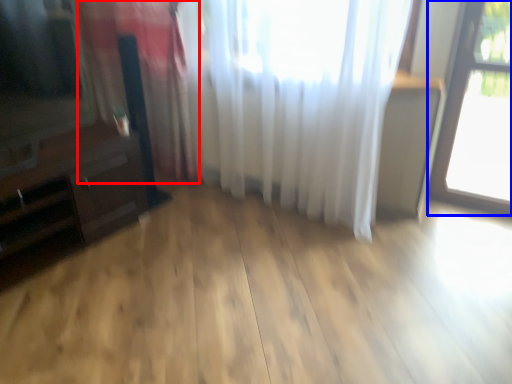
Question: Which object is further to the camera taking this photo, curtain (highlighted by a red box) or window (highlighted by a blue box)?

Choices:
 (A) curtain
 (B) window

Answer: (A)